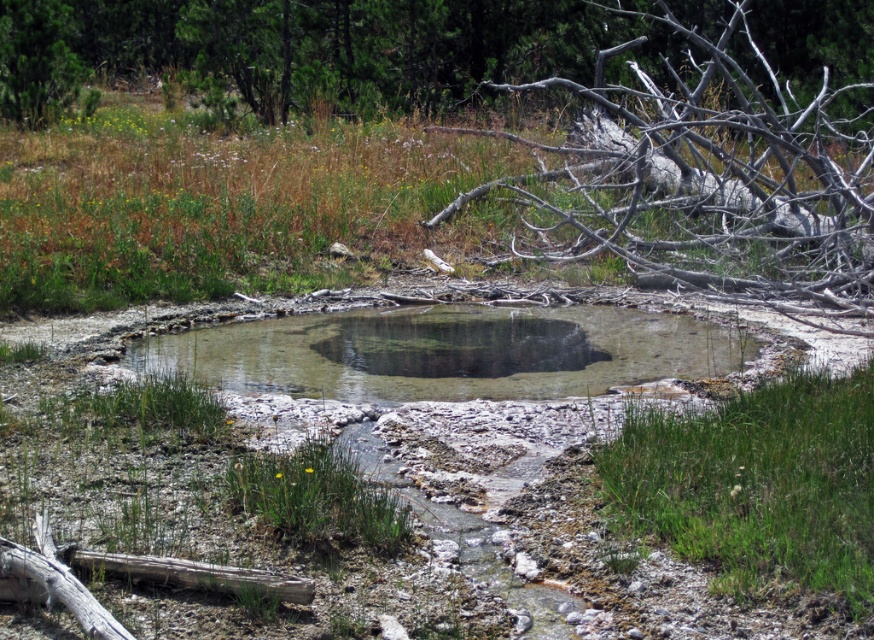
Question: Where is gray bark tree at upper right located in relation to clear water hole at center in the image?

Choices:
 (A) right
 (B) left

Answer: (A)

Question: Considering the real-world distances, which object is farthest from the gray bark tree at upper right?

Choices:
 (A) green leafy tree at upper left
 (B) green leafy tree at upper center
 (C) gray weathered log at lower left

Answer: (C)

Question: Which object appears farthest from the camera in this image?

Choices:
 (A) green leafy tree at upper center
 (B) clear water at center
 (C) clear water hole at center
 (D) green leafy tree at upper left

Answer: (A)

Question: Is clear water at center thinner than green leafy tree at upper left?

Choices:
 (A) no
 (B) yes

Answer: (A)

Question: Based on their relative distances, which object is farther from the gray weathered log at lower left?

Choices:
 (A) green leafy tree at upper left
 (B) gray bark tree at upper right

Answer: (A)

Question: Is the position of gray bark tree at upper right less distant than that of gray weathered log at lower left?

Choices:
 (A) yes
 (B) no

Answer: (B)